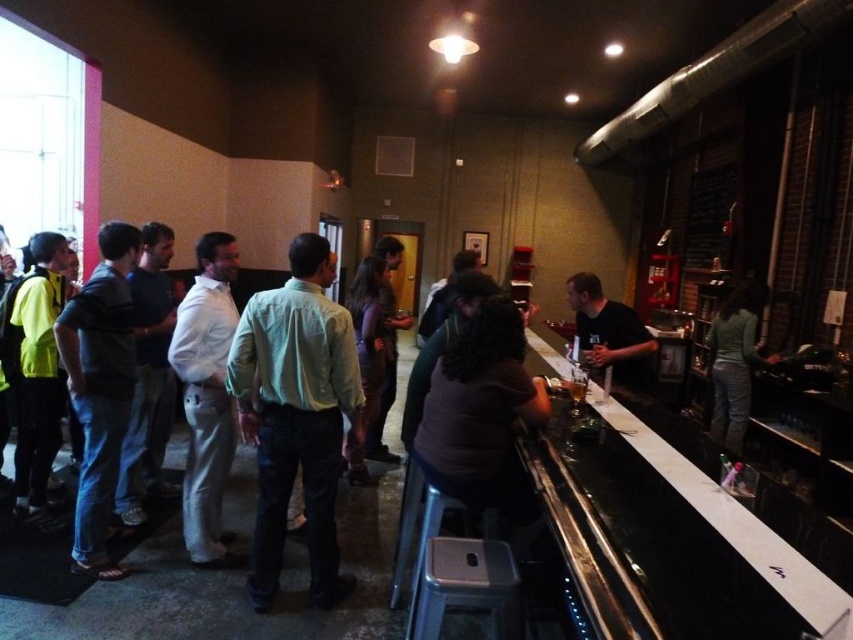
You are standing at the bar in the dimly lit space and want to move to the red doorframe on the left. There are two points marked in the scene, point (184, 419) and point (581, 410). Which point is closer to your current position at the bar?

Point (581, 410) is closer to your current position at the bar because point (184, 419) is behind it.

You are at a party and want to hand a drink to both the person wearing the white cotton shirt at center and the person wearing the black matte shirt at bar. If you can carry a tray holding drinks for both, how far apart should you position the two drinks on the tray to match their positions?

The drinks should be positioned 1.87 meters apart on the tray to match the distance between the white cotton shirt at center and the black matte shirt at bar.